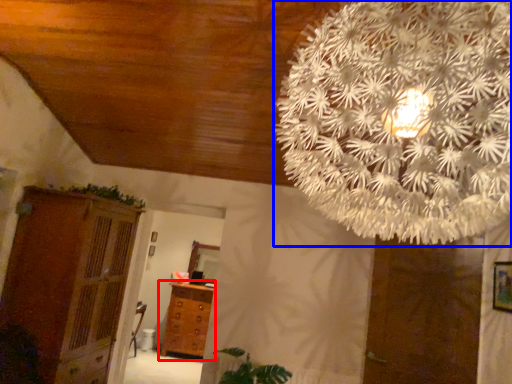
Question: Which point is further to the camera, chest of drawers (highlighted by a red box) or flower (highlighted by a blue box)?

Choices:
 (A) chest of drawers
 (B) flower

Answer: (A)